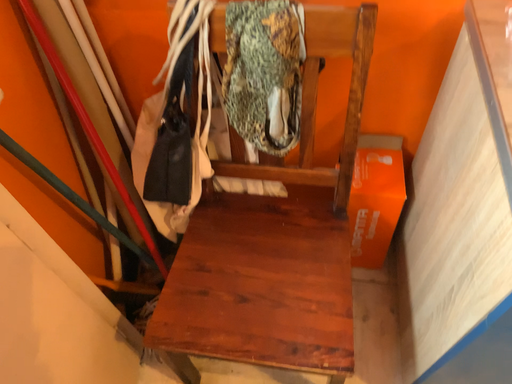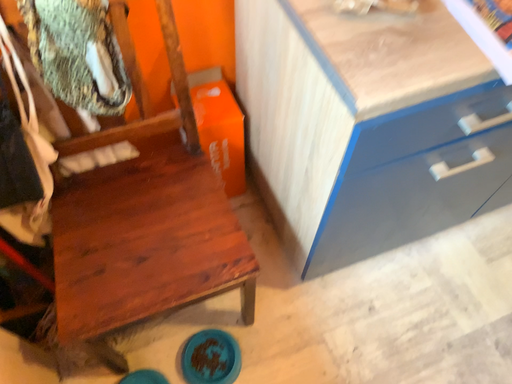
Question: Which way did the camera rotate in the video?

Choices:
 (A) rotated right
 (B) rotated left

Answer: (A)